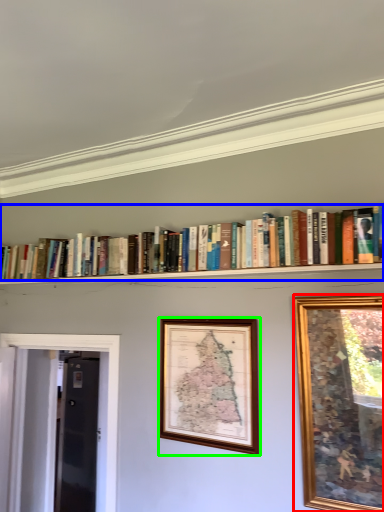
Question: Considering the real-world distances, which object is closest to picture frame (highlighted by a red box)? book (highlighted by a blue box) or picture frame (highlighted by a green box).

Choices:
 (A) book
 (B) picture frame

Answer: (B)